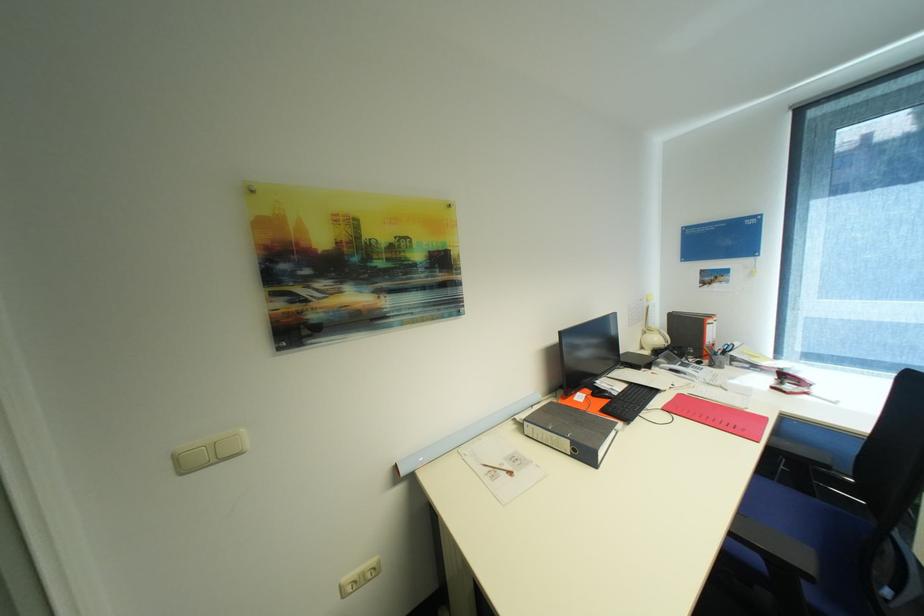
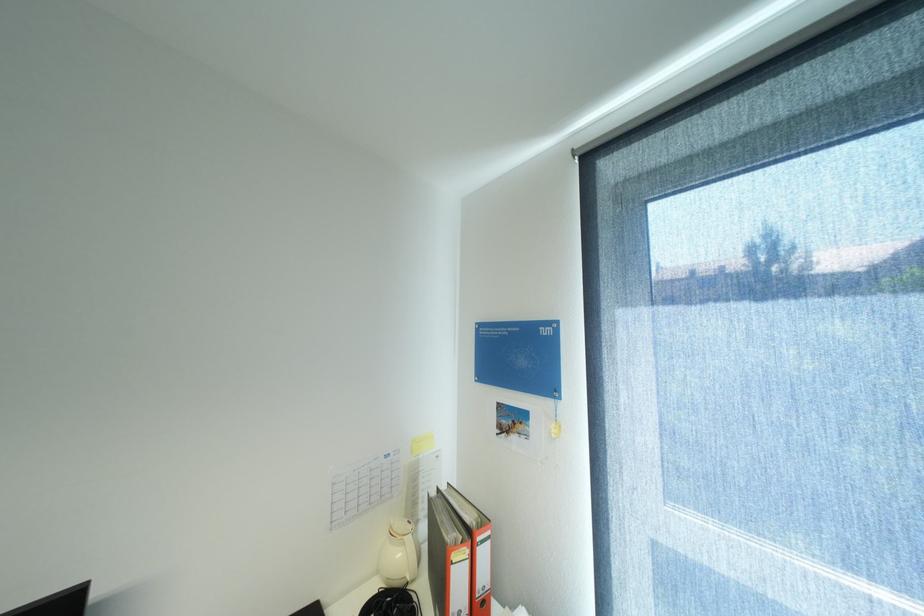
Locate, in the second image, the point that corresponds to (x=663, y=339) in the first image.

(407, 554)